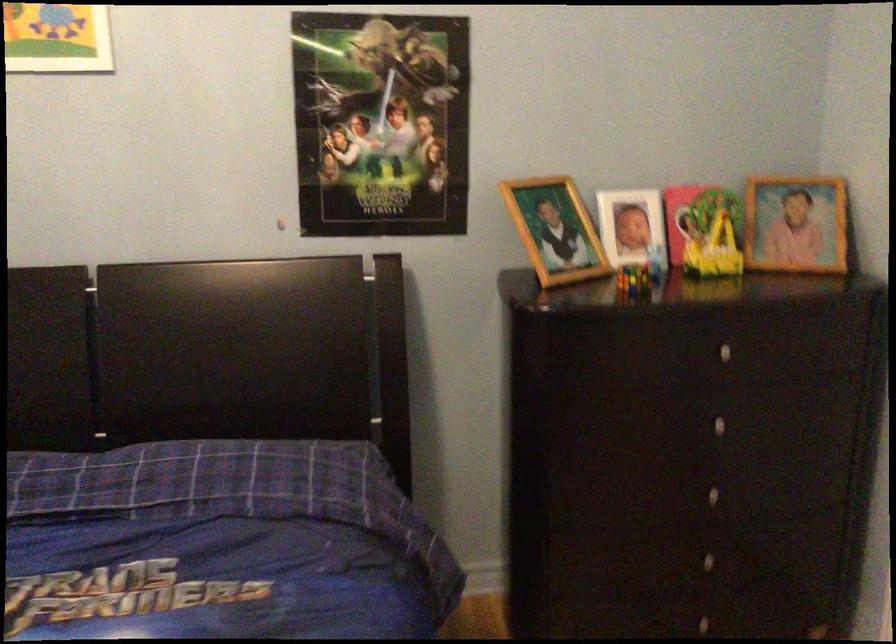
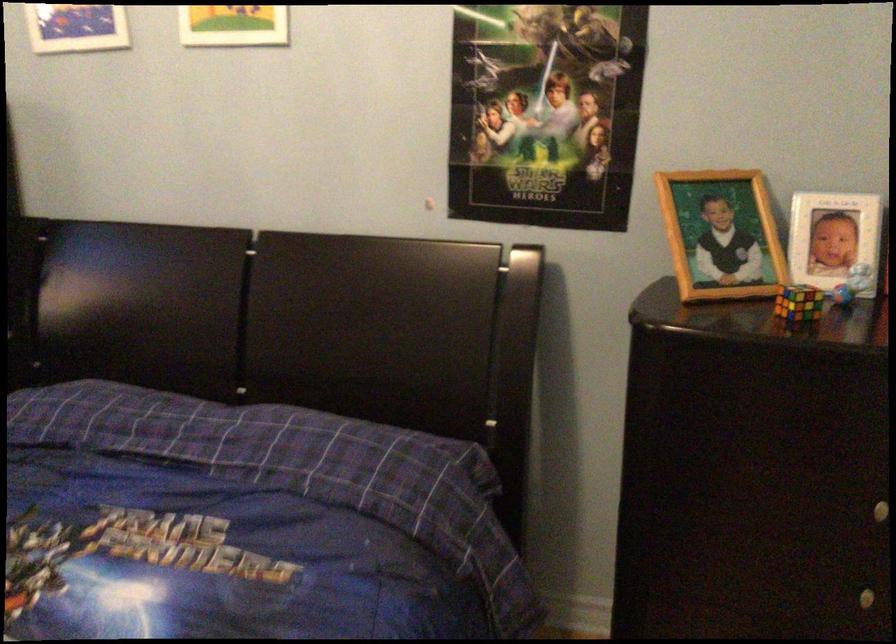
Locate, in the second image, the point that corresponds to point (553, 225) in the first image.

(720, 234)